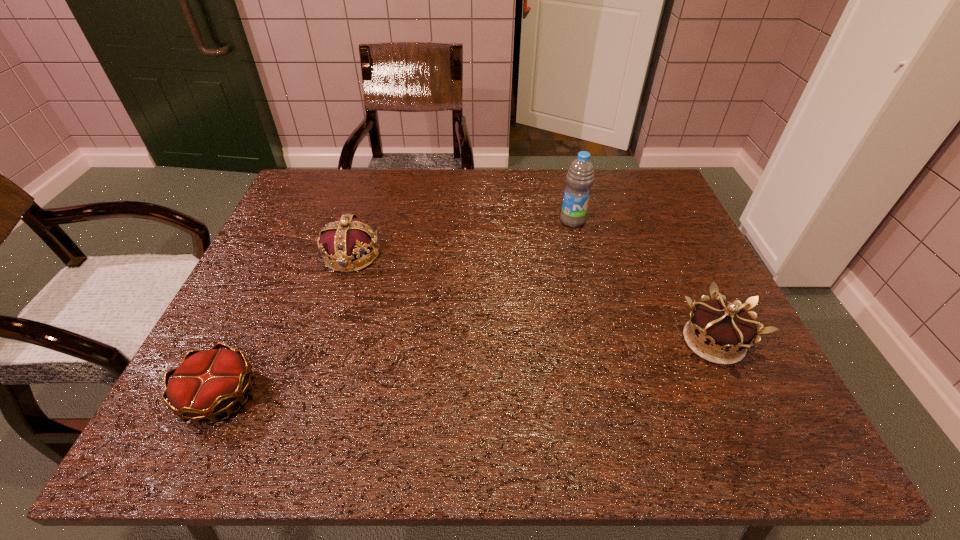
I want to click on vacant region at the far right corner of the desktop, so pyautogui.click(x=670, y=210).

This screenshot has height=540, width=960. Find the location of `empty space that is in between the farthest crown and the leftmost object`. empty space that is in between the farthest crown and the leftmost object is located at coordinates (286, 326).

Where is `unoccupied position between the rightmost object and the second crown from right to left`? This screenshot has height=540, width=960. unoccupied position between the rightmost object and the second crown from right to left is located at coordinates tap(533, 298).

Find the location of a particular element. free space between the shortest object and the farthest object is located at coordinates (396, 309).

Where is `free area in between the second farthest object and the leftmost object`? free area in between the second farthest object and the leftmost object is located at coordinates (286, 326).

Find the location of a particular element. free area in between the farthest crown and the rightmost object is located at coordinates (533, 298).

Where is `vacant point located between the farthest crown and the leftmost object`? This screenshot has width=960, height=540. vacant point located between the farthest crown and the leftmost object is located at coordinates (286, 326).

Locate an element on the screen. The image size is (960, 540). free space between the second crown from right to left and the leftmost crown is located at coordinates (286, 326).

The image size is (960, 540). In order to click on free point between the third object from left to right and the third object from right to left in this screenshot , I will do `click(462, 238)`.

Locate an element on the screen. The width and height of the screenshot is (960, 540). vacant space in between the water bottle and the second crown from right to left is located at coordinates (462, 238).